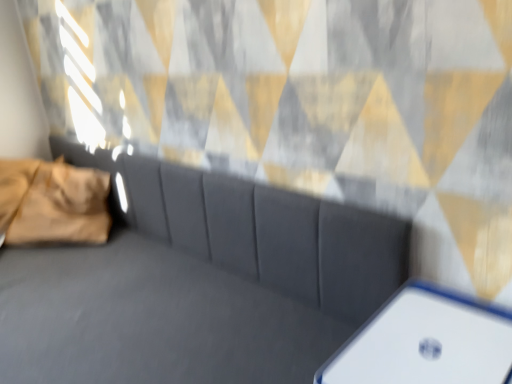
Question: Is golden velvet pillow at left facing away from suede gray couch at center?

Choices:
 (A) yes
 (B) no

Answer: (A)

Question: Can you confirm if golden velvet pillow at left is smaller than suede gray couch at center?

Choices:
 (A) yes
 (B) no

Answer: (A)

Question: Considering the relative sizes of golden velvet pillow at left and suede gray couch at center in the image provided, is golden velvet pillow at left thinner than suede gray couch at center?

Choices:
 (A) no
 (B) yes

Answer: (B)

Question: Can you confirm if golden velvet pillow at left is shorter than suede gray couch at center?

Choices:
 (A) no
 (B) yes

Answer: (B)

Question: From the image's perspective, is golden velvet pillow at left located above suede gray couch at center?

Choices:
 (A) yes
 (B) no

Answer: (A)

Question: From a real-world perspective, is golden velvet pillow at left on suede gray couch at center?

Choices:
 (A) no
 (B) yes

Answer: (B)

Question: Are white plastic phone at lower right and golden velvet pillow at left located far from each other?

Choices:
 (A) no
 (B) yes

Answer: (B)

Question: From a real-world perspective, is white plastic phone at lower right below golden velvet pillow at left?

Choices:
 (A) no
 (B) yes

Answer: (B)

Question: Is white plastic phone at lower right turned away from golden velvet pillow at left?

Choices:
 (A) no
 (B) yes

Answer: (A)

Question: Is white plastic phone at lower right located outside golden velvet pillow at left?

Choices:
 (A) yes
 (B) no

Answer: (A)

Question: Is white plastic phone at lower right bigger than golden velvet pillow at left?

Choices:
 (A) no
 (B) yes

Answer: (A)

Question: Does white plastic phone at lower right have a greater width compared to golden velvet pillow at left?

Choices:
 (A) yes
 (B) no

Answer: (B)

Question: Can you confirm if white plastic phone at lower right is thinner than suede gray couch at center?

Choices:
 (A) no
 (B) yes

Answer: (B)